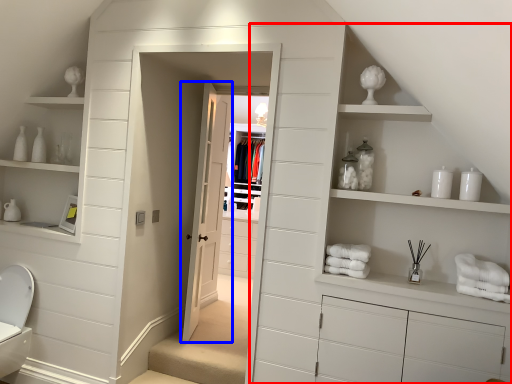
Question: Among these objects, which one is farthest to the camera, dresser (highlighted by a red box) or door (highlighted by a blue box)?

Choices:
 (A) dresser
 (B) door

Answer: (B)